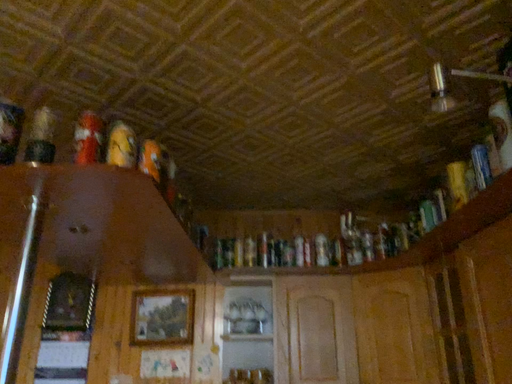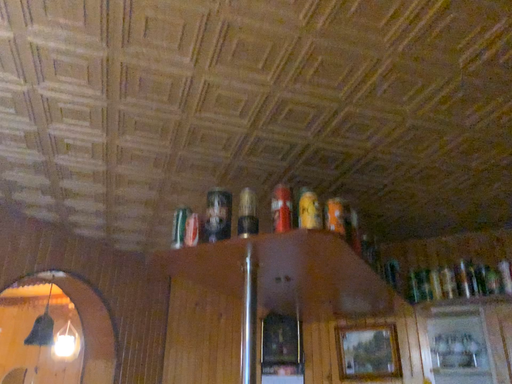
Question: How did the camera likely rotate when shooting the video?

Choices:
 (A) rotated left
 (B) rotated right

Answer: (A)